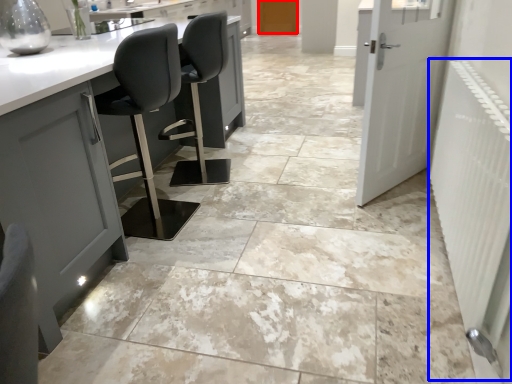
Question: Which of the following is the farthest to the observer, door (highlighted by a red box) or radiator (highlighted by a blue box)?

Choices:
 (A) door
 (B) radiator

Answer: (A)